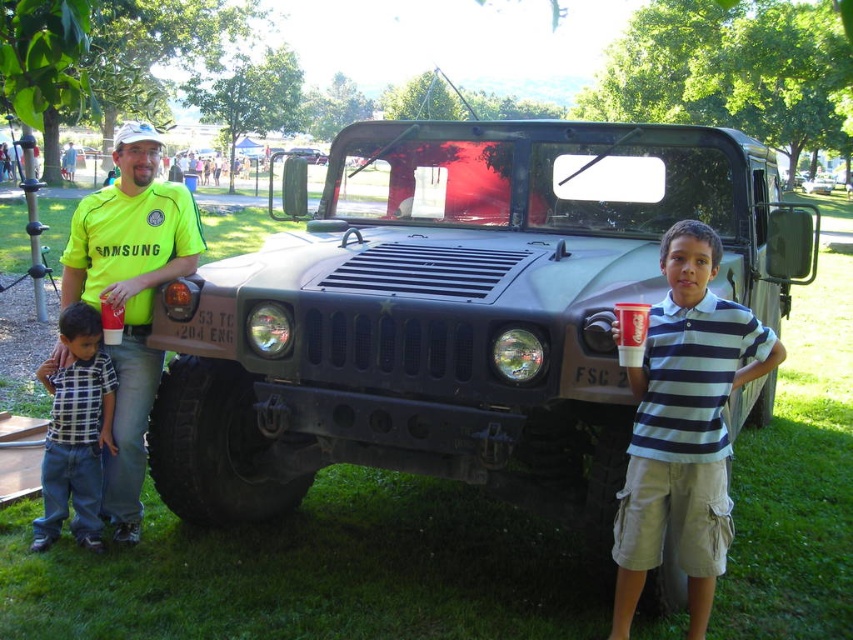
Question: Which object is closer to the camera taking this photo?

Choices:
 (A) yellow fabric shirt at center
 (B) metallic green military vehicle at center

Answer: (B)

Question: Can you confirm if neon green jersey at left is positioned to the right of metallic green military vehicle at center?

Choices:
 (A) yes
 (B) no

Answer: (A)

Question: Which of the following is the closest to the observer?

Choices:
 (A) metallic green military vehicle at center
 (B) yellow fabric shirt at center
 (C) plaid cotton shirt at left

Answer: (C)

Question: In this image, where is striped cotton shirt at center located relative to yellow fabric shirt at center?

Choices:
 (A) right
 (B) left

Answer: (A)

Question: Which object is closer to the camera taking this photo?

Choices:
 (A) yellow fabric shirt at center
 (B) neon green jersey at left
 (C) striped cotton shirt at center
 (D) green matte military vehicle at center

Answer: (C)

Question: Does striped cotton shirt at center have a smaller size compared to metallic green military vehicle at center?

Choices:
 (A) yes
 (B) no

Answer: (A)